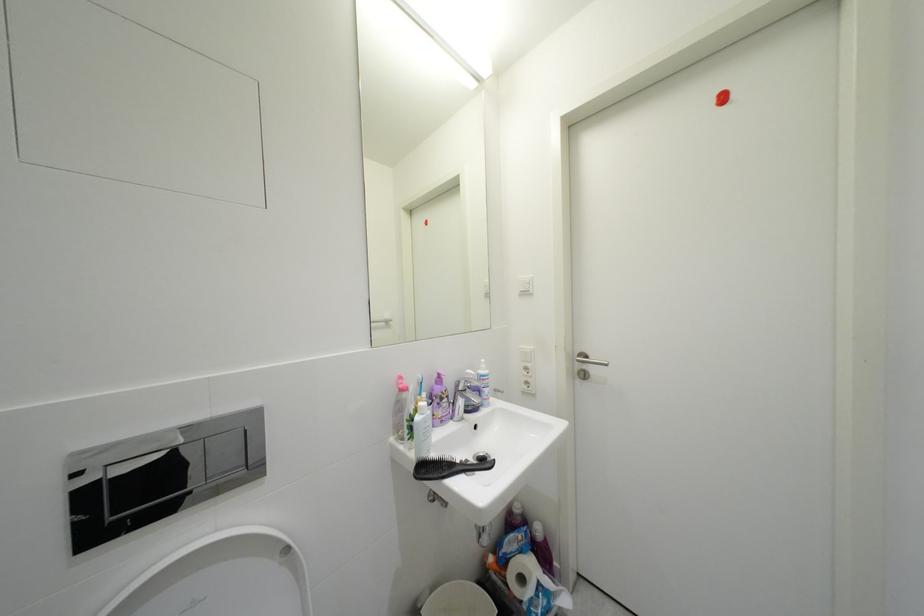
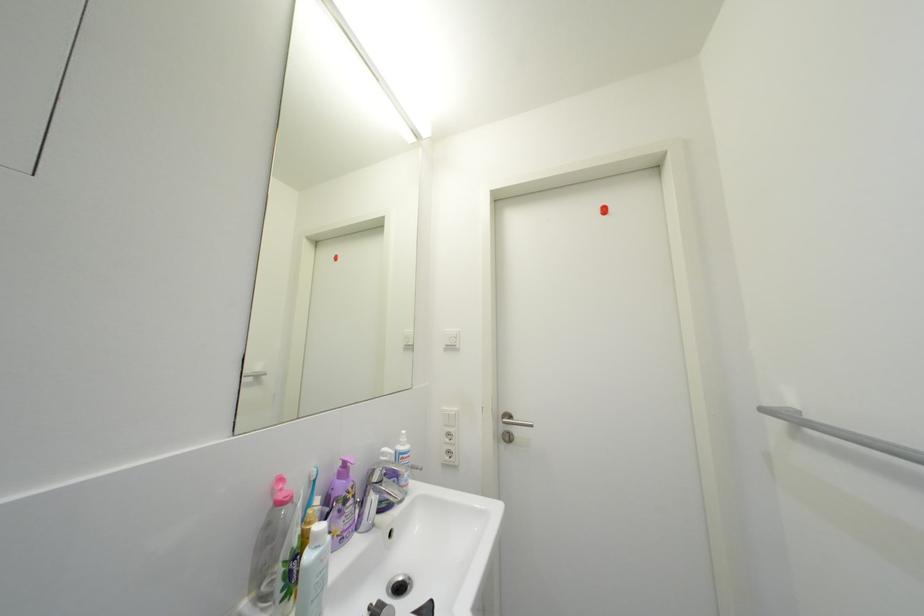
The images are taken continuously from a first-person perspective. In which direction are you moving?

The movement direction of the cameraman is left, forward.